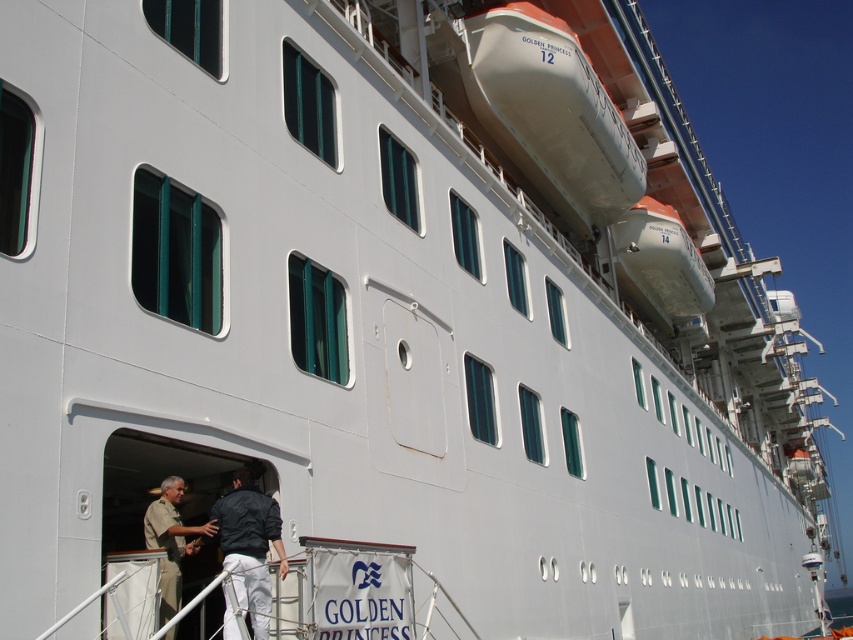
Does dark blue fabric jacket at lower left have a smaller size compared to khaki uniform at lower left?

Yes, dark blue fabric jacket at lower left is smaller than khaki uniform at lower left.

Is dark blue fabric jacket at lower left below khaki uniform at lower left?

Actually, dark blue fabric jacket at lower left is above khaki uniform at lower left.

This screenshot has height=640, width=853. What do you see at coordinates (248, 545) in the screenshot?
I see `dark blue fabric jacket at lower left` at bounding box center [248, 545].

At what (x,y) coordinates should I click in order to perform the action: click on dark blue fabric jacket at lower left. Please return your answer as a coordinate pair (x, y). The image size is (853, 640). Looking at the image, I should click on (248, 545).